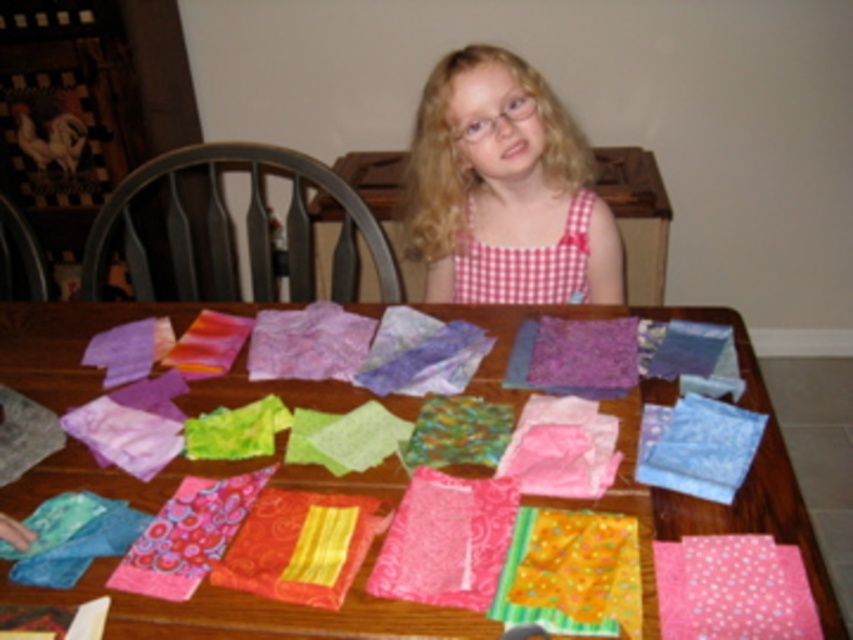
Which of these two, pink satin fabric at center or blue satin fabric at center, stands taller?

With more height is blue satin fabric at center.

Based on the photo, can you confirm if pink satin fabric at center is positioned to the left of blue satin fabric at center?

Indeed, pink satin fabric at center is positioned on the left side of blue satin fabric at center.

Which is behind, point (434, 534) or point (679, 432)?

Positioned behind is point (679, 432).

Identify the location of pink satin fabric at center. The height and width of the screenshot is (640, 853). (445, 540).

Does wooden table at center appear on the left side of pink checkered dress at center?

Indeed, wooden table at center is positioned on the left side of pink checkered dress at center.

Which is below, wooden table at center or pink checkered dress at center?

wooden table at center is lower down.

Image resolution: width=853 pixels, height=640 pixels. Describe the element at coordinates (665, 490) in the screenshot. I see `wooden table at center` at that location.

At what (x,y) coordinates should I click in order to perform the action: click on wooden table at center. Please return your answer as a coordinate pair (x, y). The height and width of the screenshot is (640, 853). Looking at the image, I should click on (665, 490).

Does pink checkered dress at center have a smaller size compared to blue satin fabric at center?

No, pink checkered dress at center is not smaller than blue satin fabric at center.

Does point (611, 296) come behind point (730, 493)?

That is True.

Where is `pink checkered dress at center`? The image size is (853, 640). pink checkered dress at center is located at coordinates (505, 188).